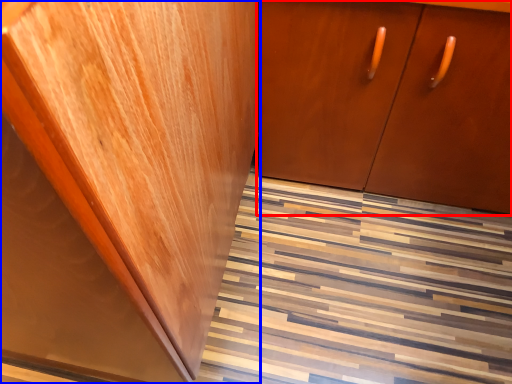
Question: Among these objects, which one is farthest to the camera, cabinetry (highlighted by a red box) or cabinetry (highlighted by a blue box)?

Choices:
 (A) cabinetry
 (B) cabinetry

Answer: (A)